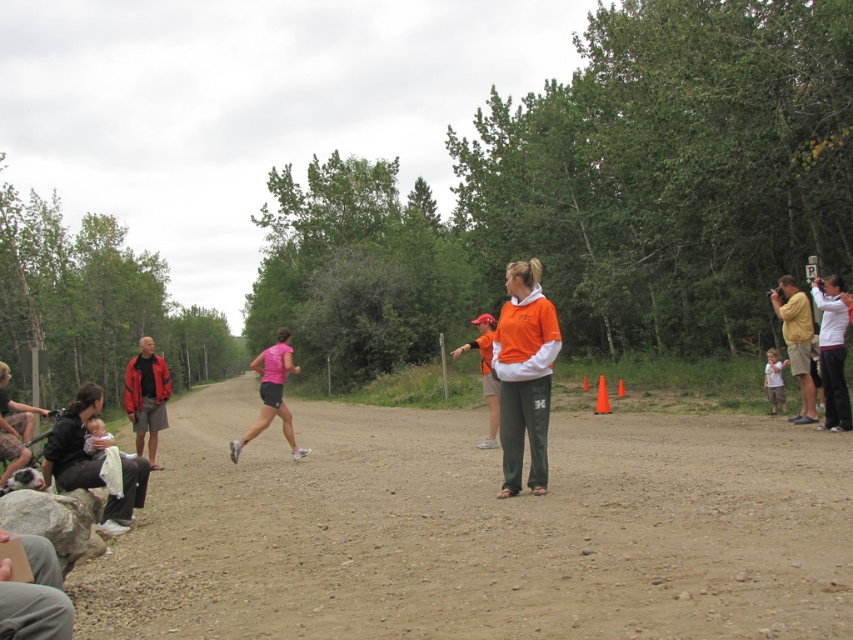
Does brown dirt field at center have a lesser width compared to matte red jacket at left?

Correct, brown dirt field at center's width is less than matte red jacket at left's.

Is brown dirt field at center in front of matte red jacket at left?

Yes, it is.

Identify the location of brown dirt field at center. (479, 529).

Is point (398, 508) positioned before point (824, 390)?

Yes, point (398, 508) is closer to viewer.

Find the location of `brown dirt field at center`. brown dirt field at center is located at coordinates (479, 529).

Does pink fabric shorts at center have a lesser width compared to orange fabric shirt at center?

No, pink fabric shorts at center is not thinner than orange fabric shirt at center.

Does point (277, 413) lie behind point (489, 440)?

Yes.

Find the location of `pink fabric shorts at center`. pink fabric shorts at center is located at coordinates (271, 394).